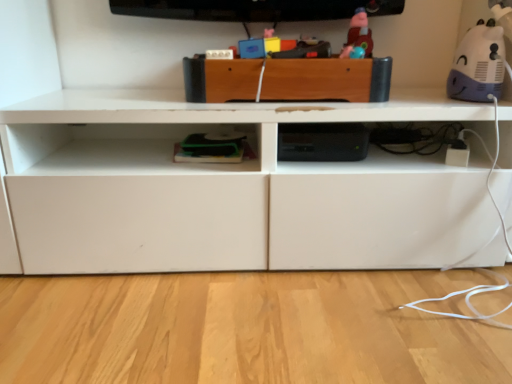
Question: Is matte plastic toy at upper center, which ranks as the 2th toy in right-to-left order, not close to purple matte plush toy at upper right, the 1th toy positioned from the right?

Choices:
 (A) yes
 (B) no

Answer: (B)

Question: Is matte plastic toy at upper center, which ranks as the 2th toy in right-to-left order, bigger than purple matte plush toy at upper right, the 2th toy in the left-to-right sequence?

Choices:
 (A) yes
 (B) no

Answer: (B)

Question: Does matte plastic toy at upper center, which ranks as the 2th toy in right-to-left order, have a greater height compared to purple matte plush toy at upper right, the 1th toy positioned from the right?

Choices:
 (A) yes
 (B) no

Answer: (B)

Question: Is matte plastic toy at upper center, which ranks as the 2th toy in right-to-left order, thinner than purple matte plush toy at upper right, the 2th toy in the left-to-right sequence?

Choices:
 (A) no
 (B) yes

Answer: (B)

Question: Is matte plastic toy at upper center, marked as the first toy in a left-to-right arrangement, positioned beyond the bounds of purple matte plush toy at upper right, the 1th toy positioned from the right?

Choices:
 (A) yes
 (B) no

Answer: (A)

Question: Is matte plastic toy at upper center, marked as the first toy in a left-to-right arrangement, surrounding purple matte plush toy at upper right, the 2th toy in the left-to-right sequence?

Choices:
 (A) yes
 (B) no

Answer: (B)

Question: Is purple matte plush toy at upper right, the 2th toy in the left-to-right sequence, placed right next to wooden drawer at center?

Choices:
 (A) no
 (B) yes

Answer: (A)

Question: Is purple matte plush toy at upper right, the 2th toy in the left-to-right sequence, wider than wooden drawer at center?

Choices:
 (A) no
 (B) yes

Answer: (A)

Question: Considering the relative sizes of purple matte plush toy at upper right, the 2th toy in the left-to-right sequence, and wooden drawer at center in the image provided, is purple matte plush toy at upper right, the 2th toy in the left-to-right sequence, bigger than wooden drawer at center?

Choices:
 (A) no
 (B) yes

Answer: (A)

Question: Can we say purple matte plush toy at upper right, the 1th toy positioned from the right, lies outside wooden drawer at center?

Choices:
 (A) yes
 (B) no

Answer: (A)

Question: From a real-world perspective, is purple matte plush toy at upper right, the 1th toy positioned from the right, under wooden drawer at center?

Choices:
 (A) yes
 (B) no

Answer: (B)

Question: Is wooden drawer at center completely or partially inside purple matte plush toy at upper right, the 1th toy positioned from the right?

Choices:
 (A) yes
 (B) no

Answer: (B)

Question: Considering the relative sizes of matte plastic toy at upper center, which ranks as the 2th toy in right-to-left order, and wooden drawer at center in the image provided, is matte plastic toy at upper center, which ranks as the 2th toy in right-to-left order, taller than wooden drawer at center?

Choices:
 (A) yes
 (B) no

Answer: (A)